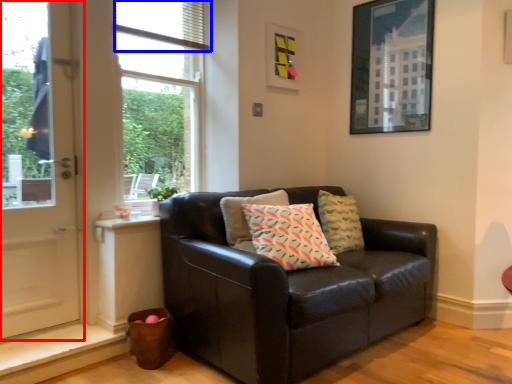
Question: Which object appears closest to the camera in this image, door (highlighted by a red box) or blind (highlighted by a blue box)?

Choices:
 (A) door
 (B) blind

Answer: (A)